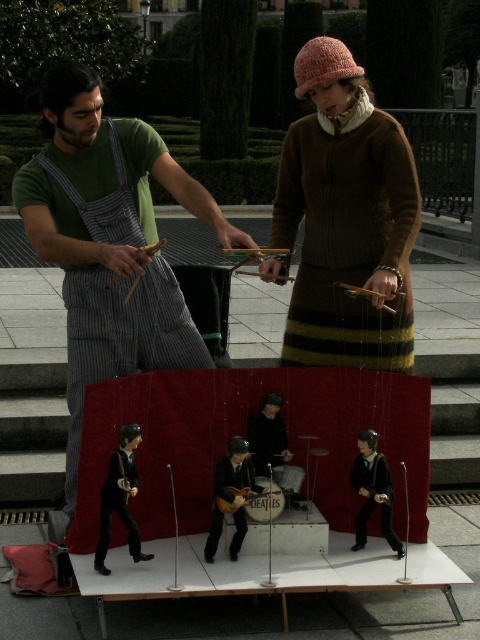
Question: Considering the relative positions of green cotton shirt at center and knitted brown sweater at center in the image provided, where is green cotton shirt at center located with respect to knitted brown sweater at center?

Choices:
 (A) right
 (B) left

Answer: (B)

Question: Is green cotton shirt at center bigger than wooden acoustic guitar at center?

Choices:
 (A) yes
 (B) no

Answer: (A)

Question: Among these objects, which one is nearest to the camera?

Choices:
 (A) green cotton shirt at center
 (B) wooden acoustic guitar at center

Answer: (B)

Question: Is the position of knitted brown sweater at center less distant than that of wooden acoustic guitar at center?

Choices:
 (A) yes
 (B) no

Answer: (B)

Question: Which point is farther to the camera?

Choices:
 (A) knitted brown sweater at center
 (B) wooden acoustic guitar at center

Answer: (A)

Question: Considering the real-world distances, which object is farthest from the green cotton shirt at center?

Choices:
 (A) wooden acoustic guitar at center
 (B) knitted brown sweater at center

Answer: (A)